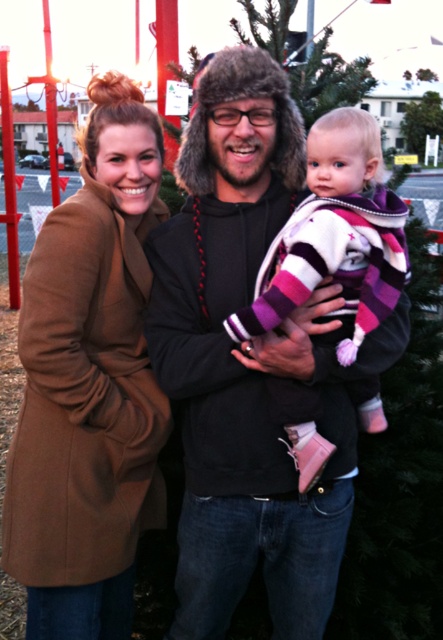
Between brown wool coat at center and pink striped sweater at center, which one is positioned lower?

Positioned lower is brown wool coat at center.

Who is taller, brown wool coat at center or pink striped sweater at center?

brown wool coat at center

Does point (127, 172) lie behind point (303, 259)?

Yes.

You are a GUI agent. You are given a task and a screenshot of the screen. Output one action in this format:
    pyautogui.click(x=<x>, y=<y>)
    Task: Click on the brown wool coat at center
    The height and width of the screenshot is (640, 443).
    Given the screenshot: What is the action you would take?
    pyautogui.click(x=89, y=385)

Does brown wool coat at center have a lesser height compared to green textured christmas tree at center?

Incorrect, brown wool coat at center's height does not fall short of green textured christmas tree at center's.

Does brown wool coat at center have a smaller size compared to green textured christmas tree at center?

Incorrect, brown wool coat at center is not smaller in size than green textured christmas tree at center.

Is point (101, 426) less distant than point (264, 529)?

Yes, it is.

Locate an element on the screen. This screenshot has width=443, height=640. brown wool coat at center is located at coordinates (89, 385).

Does green textured christmas tree at center lie behind pink striped sweater at center?

Yes, it is behind pink striped sweater at center.

Between green textured christmas tree at center and pink striped sweater at center, which one appears on the left side from the viewer's perspective?

Positioned to the left is green textured christmas tree at center.

Does point (259, 448) come in front of point (345, 232)?

No, it is behind (345, 232).

The height and width of the screenshot is (640, 443). Find the location of `green textured christmas tree at center`. green textured christmas tree at center is located at coordinates (221, 369).